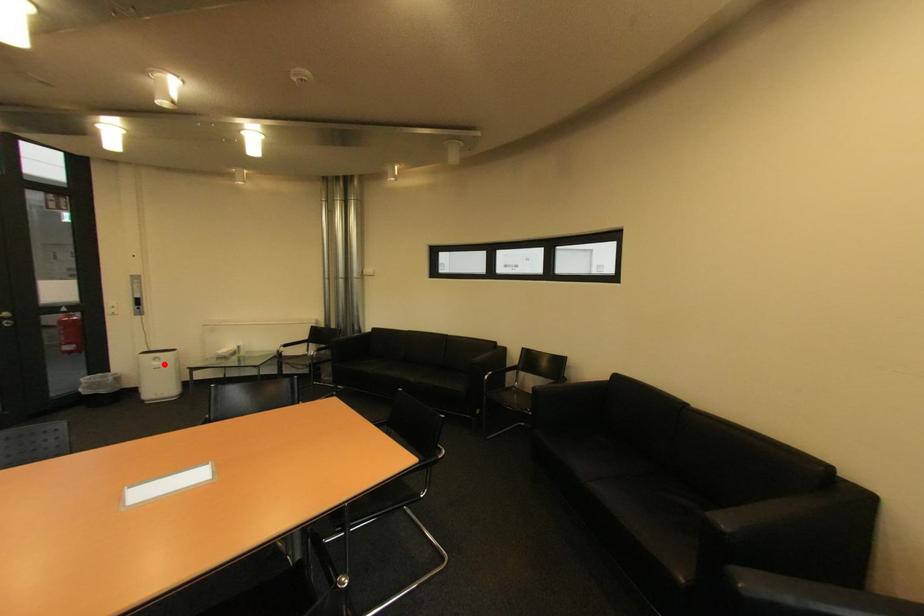
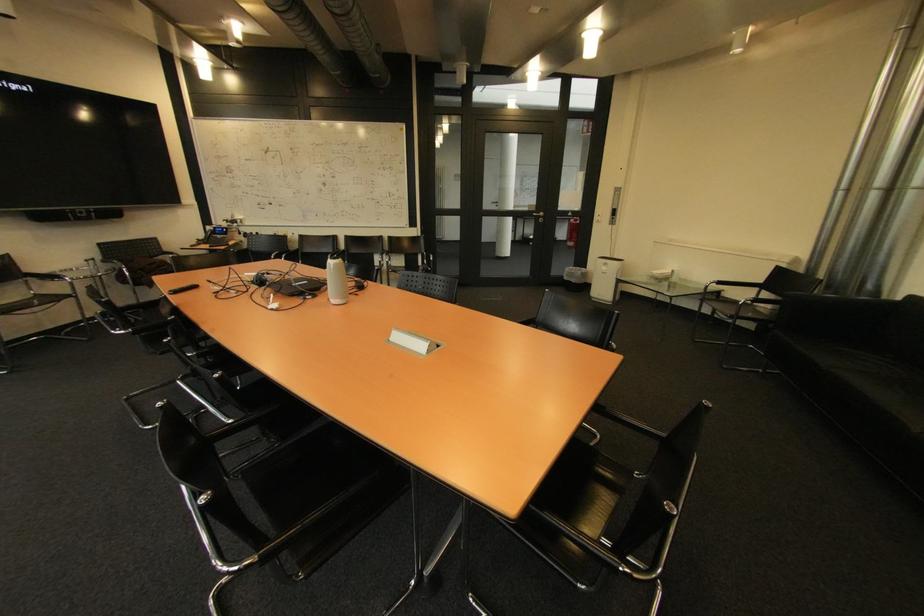
Question: I am providing you with two images of the same scene from different viewpoints. A red point is shown in image1. For the corresponding object point in image2, is it positioned nearer or farther from the camera?

Choices:
 (A) Nearer
 (B) Farther

Answer: (A)